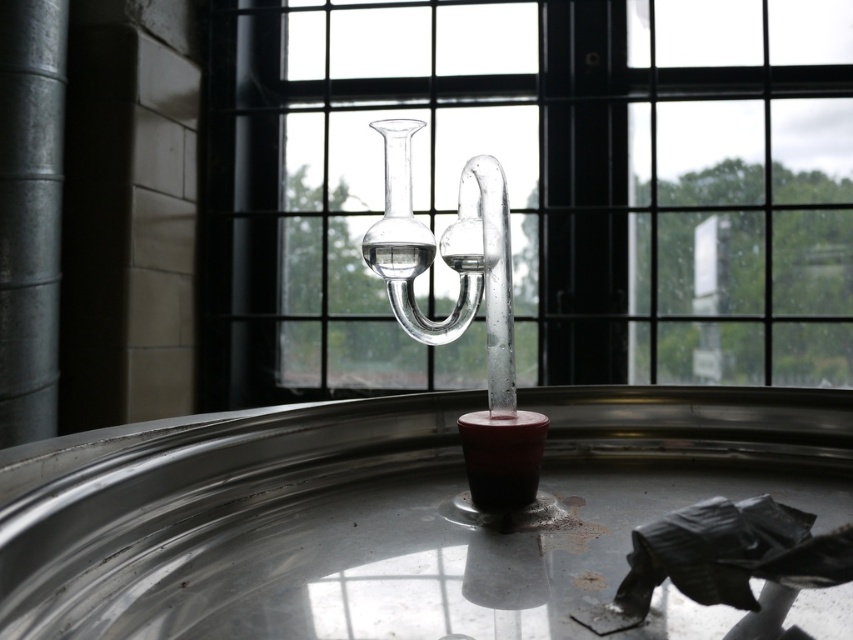
You are setting up a chemistry experiment and need to place a new equipment on the surface. The smooth metallic pillar at left and the matte black candle holder at center are already present. Which object is directly underneath the other?

The smooth metallic pillar at left is positioned over the matte black candle holder at center, so the matte black candle holder at center is directly underneath the smooth metallic pillar at left.

You are setting up a lab experiment and need to place a heavy equipment box next to the smooth metallic pillar at left and the matte black candle holder at center. Which object should you place the box closer to if you want it to be near the larger one?

The smooth metallic pillar at left is larger in size than the matte black candle holder at center, so you should place the box closer to the smooth metallic pillar at left.